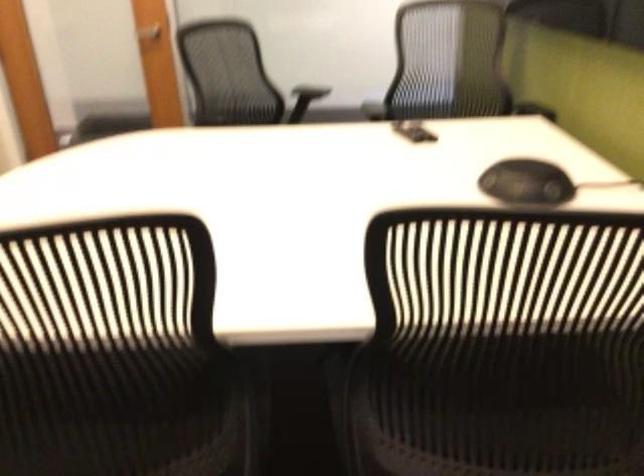
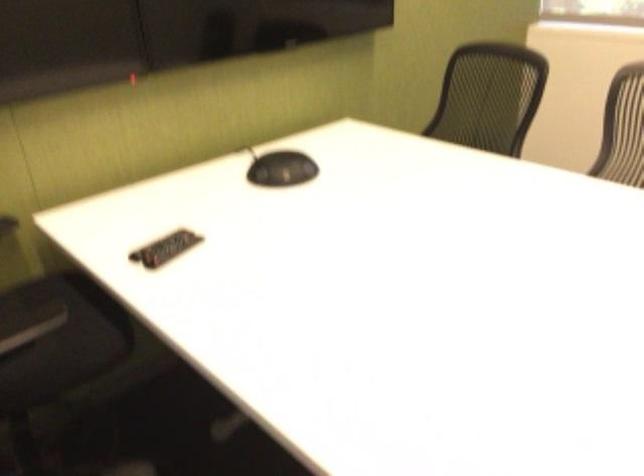
Locate, in the second image, the point that corresponds to the point at 504,175 in the first image.

(281, 169)